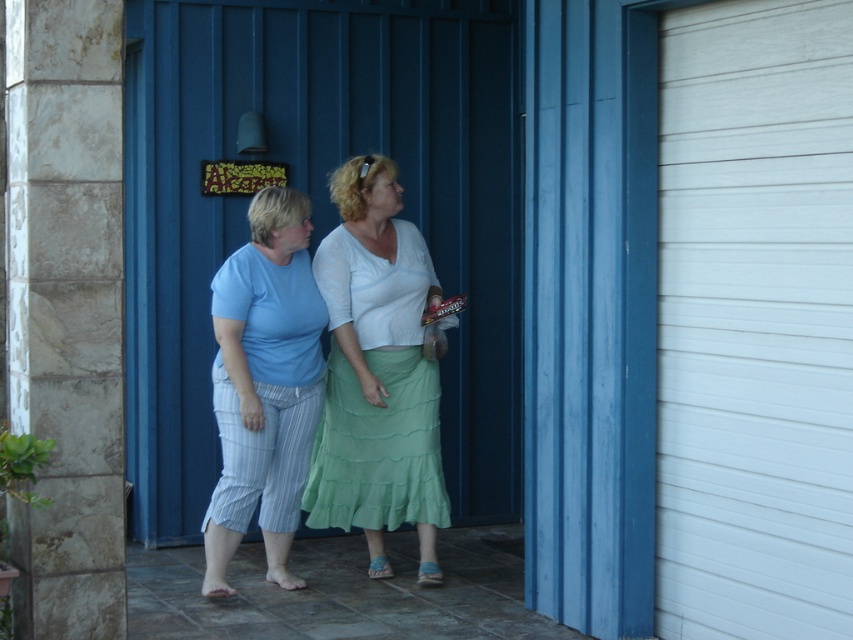
Which is more to the right, blue metal/glass door at center or blue striped pants at left?

blue metal/glass door at center

Who is higher up, blue metal/glass door at center or blue striped pants at left?

blue metal/glass door at center

Which is in front, point (456, 512) or point (316, 314)?

Point (316, 314) is more forward.

Find the location of `blue metal/glass door at center`. blue metal/glass door at center is located at coordinates (318, 209).

Describe the element at coordinates (378, 372) in the screenshot. The image size is (853, 640). I see `light green textured skirt at center` at that location.

Does light green textured skirt at center have a larger size compared to blue striped pants at left?

Correct, light green textured skirt at center is larger in size than blue striped pants at left.

What are the coordinates of `light green textured skirt at center` in the screenshot? It's located at (378, 372).

Does blue metal/glass door at center appear on the right side of light green textured skirt at center?

No, blue metal/glass door at center is not to the right of light green textured skirt at center.

Measure the distance between point (196,385) and camera.

They are 24.22 feet apart.

Where is `blue metal/glass door at center`? blue metal/glass door at center is located at coordinates (318, 209).